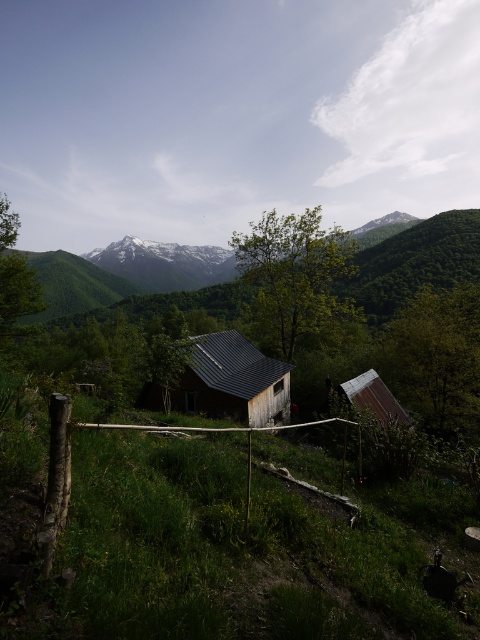
You are standing at the edge of the wooden fence in the rural landscape. You see the dark gray shingles at center and the rusty metal hut at lower right. Which object is closer to your left side?

The dark gray shingles at center is to the left of rusty metal hut at lower right, so the dark gray shingles at center is closer to your left side.